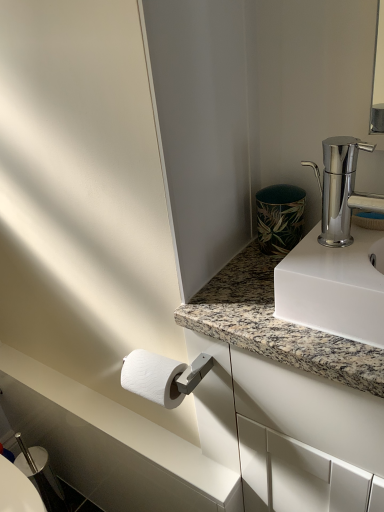
You are a GUI agent. You are given a task and a screenshot of the screen. Output one action in this format:
    pyautogui.click(x=<x>, y=<y>)
    Task: Click on the empty space that is ontop of white marble countertop at lower left (from a real-world perspective)
    The width and height of the screenshot is (384, 512).
    Given the screenshot: What is the action you would take?
    pyautogui.click(x=98, y=408)